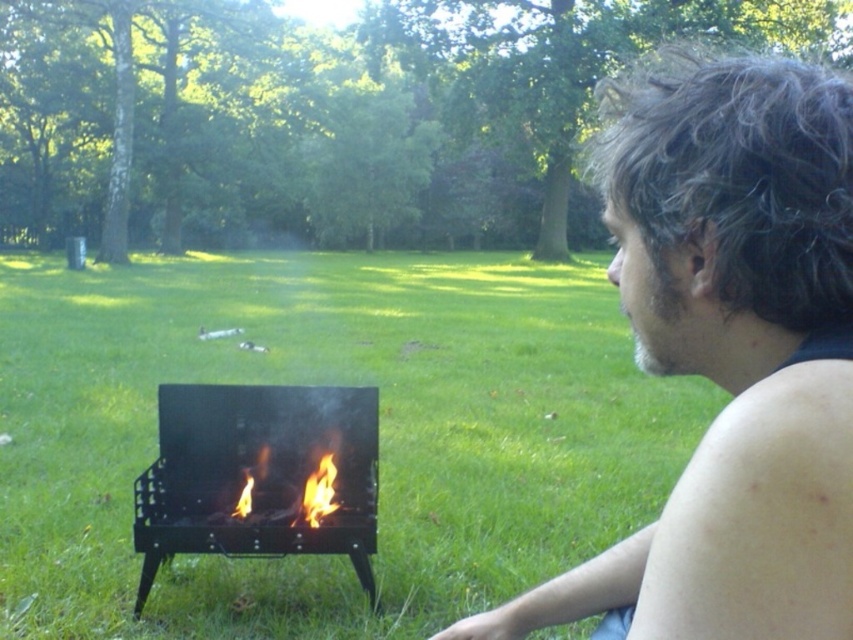
Question: Which of the following is the closest to the observer?

Choices:
 (A) dark brown hair at upper right
 (B) flamematerial/texture at center

Answer: (A)

Question: Which of these objects is positioned closest to the green grass at center?

Choices:
 (A) dark brown hair at upper right
 (B) black matte barbecue grill at lower left

Answer: (B)

Question: Is green grass at center above black matte barbecue grill at lower left?

Choices:
 (A) no
 (B) yes

Answer: (B)

Question: Can you confirm if green grass at center is positioned below dark brown hair at upper right?

Choices:
 (A) no
 (B) yes

Answer: (A)

Question: Can you confirm if black matte barbecue grill at lower left is positioned below flamematerial/texture at center?

Choices:
 (A) yes
 (B) no

Answer: (B)

Question: Estimate the real-world distances between objects in this image. Which object is farther from the dark brown hair at upper right?

Choices:
 (A) black matte barbecue grill at lower left
 (B) flamematerial/texture at center

Answer: (B)